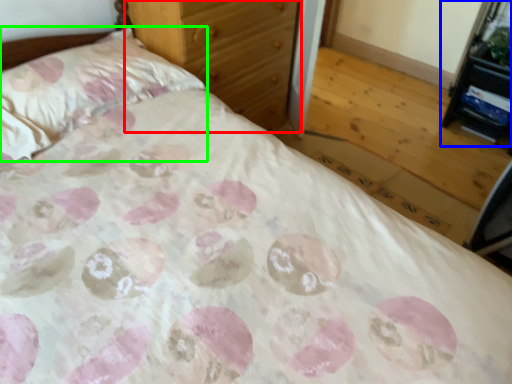
Question: Which object is the closest to the chest of drawers (highlighted by a red box)? Choose among these: vanity (highlighted by a blue box) or pillow (highlighted by a green box).

Choices:
 (A) vanity
 (B) pillow

Answer: (B)